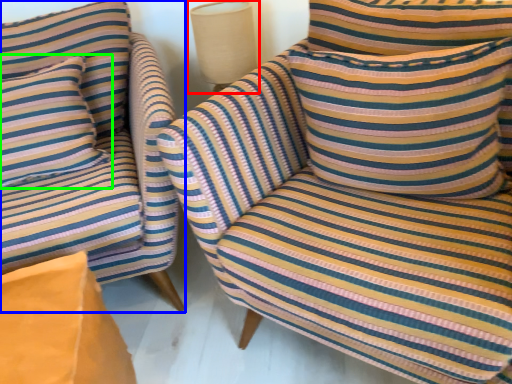
Question: Which object is the farthest from table lamp (highlighted by a red box)? Choose among these: chair (highlighted by a blue box) or pillow (highlighted by a green box).

Choices:
 (A) chair
 (B) pillow

Answer: (B)